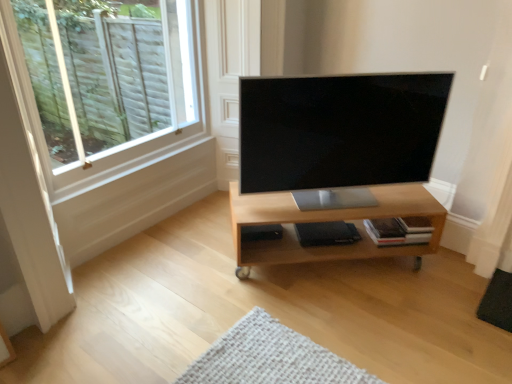
Question: From a real-world perspective, does light wood shelf at center stand above white wood window at upper left?

Choices:
 (A) no
 (B) yes

Answer: (A)

Question: Is light wood shelf at center positioned before white wood window at upper left?

Choices:
 (A) yes
 (B) no

Answer: (B)

Question: Is light wood shelf at center thinner than white wood window at upper left?

Choices:
 (A) no
 (B) yes

Answer: (A)

Question: From a real-world perspective, does light wood shelf at center sit lower than white wood window at upper left?

Choices:
 (A) no
 (B) yes

Answer: (B)

Question: Does light wood shelf at center turn towards white wood window at upper left?

Choices:
 (A) yes
 (B) no

Answer: (B)

Question: Do you think white wood window at upper left is within satin black tv at center, or outside of it?

Choices:
 (A) inside
 (B) outside

Answer: (B)

Question: From a real-world perspective, is white wood window at upper left positioned above or below satin black tv at center?

Choices:
 (A) below
 (B) above

Answer: (B)

Question: Is point (161, 69) closer or farther from the camera than point (402, 173)?

Choices:
 (A) closer
 (B) farther

Answer: (B)

Question: Is white wood window at upper left bigger or smaller than satin black tv at center?

Choices:
 (A) big
 (B) small

Answer: (A)

Question: Does point (396, 150) appear closer or farther from the camera than point (88, 81)?

Choices:
 (A) closer
 (B) farther

Answer: (A)

Question: In terms of size, does satin black tv at center appear bigger or smaller than white wood window at upper left?

Choices:
 (A) big
 (B) small

Answer: (B)

Question: From the image's perspective, is satin black tv at center located above or below white wood window at upper left?

Choices:
 (A) below
 (B) above

Answer: (A)

Question: Visually, is satin black tv at center positioned to the left or to the right of white wood window at upper left?

Choices:
 (A) right
 (B) left

Answer: (A)

Question: From the image's perspective, is light wood shelf at center positioned above or below white wood window at upper left?

Choices:
 (A) above
 (B) below

Answer: (B)

Question: In terms of size, does light wood shelf at center appear bigger or smaller than white wood window at upper left?

Choices:
 (A) big
 (B) small

Answer: (A)